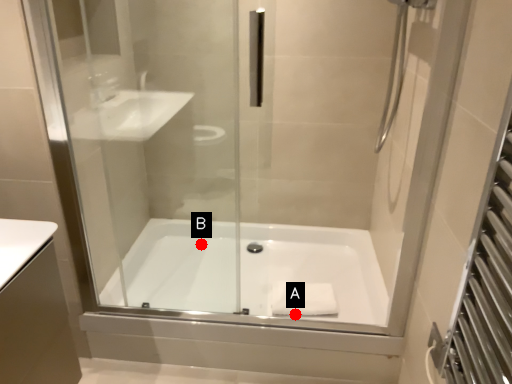
Question: Two points are circled on the image, labeled by A and B beside each circle. Among these points, which one is nearest to the camera?

Choices:
 (A) A is closer
 (B) B is closer

Answer: (A)